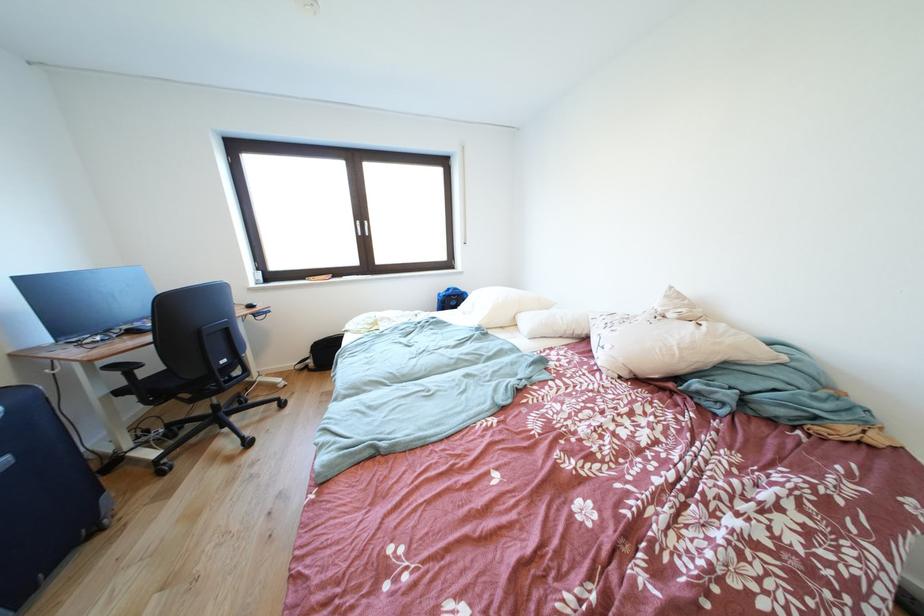
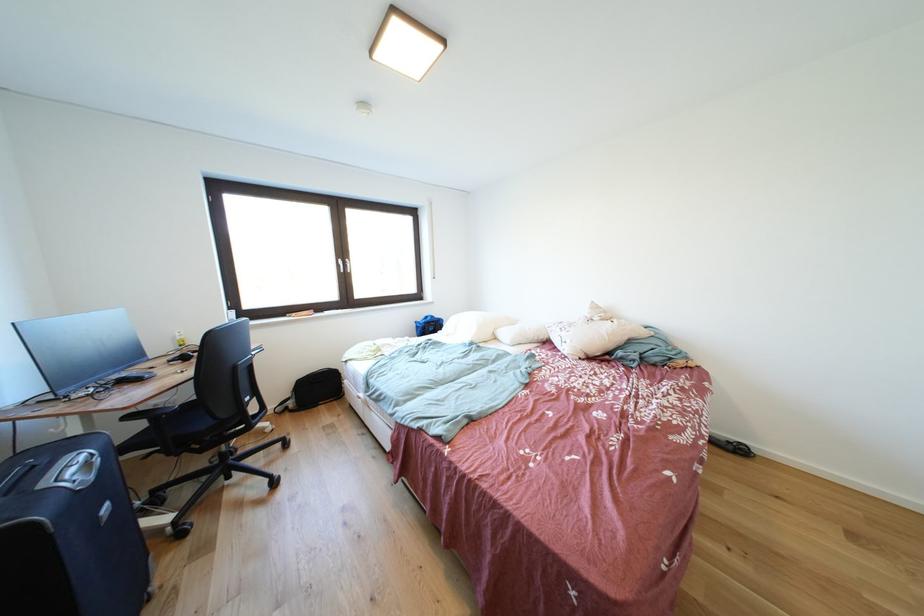
Locate, in the second image, the point that corresponds to [319,367] in the first image.

(299, 408)